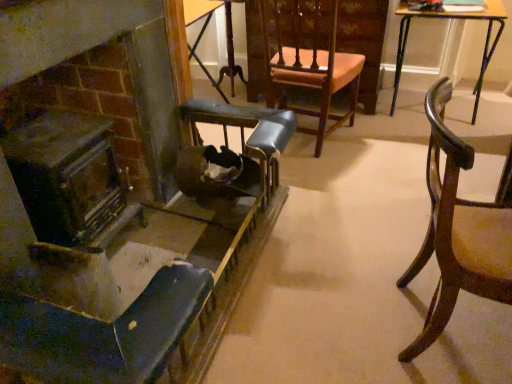
Question: Is wooden table at center, which is the 2th table in right-to-left order, at the right side of wooden chair with upholstered seat at center, the 2th chair positioned from the left?

Choices:
 (A) no
 (B) yes

Answer: (A)

Question: From a real-world perspective, does wooden table at center, marked as the 1th table in a left-to-right arrangement, stand above wooden chair with upholstered seat at center, the 2th chair positioned from the left?

Choices:
 (A) no
 (B) yes

Answer: (A)

Question: Can you confirm if wooden table at center, which is the 2th table in right-to-left order, is shorter than wooden chair with upholstered seat at center, the 2th chair positioned from the right?

Choices:
 (A) no
 (B) yes

Answer: (B)

Question: Is wooden table at center, marked as the 1th table in a left-to-right arrangement, turned away from wooden chair with upholstered seat at center, the 2th chair positioned from the right?

Choices:
 (A) yes
 (B) no

Answer: (B)

Question: Considering the relative sizes of wooden table at center, which is the 2th table in right-to-left order, and wooden chair with upholstered seat at center, the 2th chair positioned from the left, in the image provided, is wooden table at center, which is the 2th table in right-to-left order, bigger than wooden chair with upholstered seat at center, the 2th chair positioned from the left,?

Choices:
 (A) no
 (B) yes

Answer: (A)

Question: Which is correct: mahogany wood chair at right, the 1th chair in the right-to-left sequence, is inside wooden table at upper right, which ranks as the 1th table in right-to-left order, or outside of it?

Choices:
 (A) inside
 (B) outside

Answer: (B)

Question: In terms of width, does mahogany wood chair at right, acting as the third chair starting from the left, look wider or thinner when compared to wooden table at upper right, which ranks as the 1th table in right-to-left order?

Choices:
 (A) wide
 (B) thin

Answer: (B)

Question: Is mahogany wood chair at right, acting as the third chair starting from the left, bigger or smaller than wooden table at upper right, which ranks as the 2th table in left-to-right order?

Choices:
 (A) small
 (B) big

Answer: (A)

Question: In the image, is mahogany wood chair at right, the 1th chair in the right-to-left sequence, on the left side or the right side of wooden table at upper right, which ranks as the 1th table in right-to-left order?

Choices:
 (A) right
 (B) left

Answer: (B)

Question: Is wooden table at upper right, which ranks as the 2th table in left-to-right order, to the left or to the right of wooden table at center, which is the 2th table in right-to-left order, in the image?

Choices:
 (A) right
 (B) left

Answer: (A)

Question: Based on their sizes in the image, would you say wooden table at upper right, which ranks as the 2th table in left-to-right order, is bigger or smaller than wooden table at center, marked as the 1th table in a left-to-right arrangement?

Choices:
 (A) big
 (B) small

Answer: (A)

Question: Choose the correct answer: Is wooden table at upper right, which ranks as the 1th table in right-to-left order, inside wooden table at center, marked as the 1th table in a left-to-right arrangement, or outside it?

Choices:
 (A) outside
 (B) inside

Answer: (A)

Question: In terms of width, does wooden table at upper right, which ranks as the 2th table in left-to-right order, look wider or thinner when compared to wooden table at center, marked as the 1th table in a left-to-right arrangement?

Choices:
 (A) thin
 (B) wide

Answer: (B)

Question: From a real-world perspective, is dark brown wood fireplace at left physically located above or below wooden chair with upholstered seat at center, the 2th chair positioned from the left?

Choices:
 (A) above
 (B) below

Answer: (B)

Question: In the image, is dark brown wood fireplace at left positioned in front of or behind wooden chair with upholstered seat at center, the 2th chair positioned from the left?

Choices:
 (A) behind
 (B) front

Answer: (B)